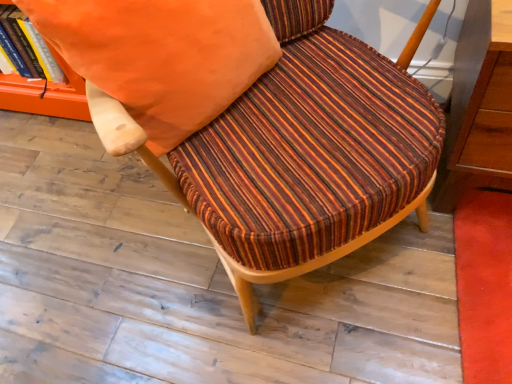
Locate an element on the screen. The image size is (512, 384). orange fabric book at upper left is located at coordinates (27, 47).

Where is `striped fabric chair at center`? This screenshot has width=512, height=384. striped fabric chair at center is located at coordinates (311, 260).

I want to click on orange fabric book at upper left, so click(27, 47).

Considering the points (433, 3) and (154, 58), which point is in front, point (433, 3) or point (154, 58)?

Point (154, 58)

Is striped fabric chair at center looking in the opposite direction of orange fabric pillow at upper center?

Absolutely, striped fabric chair at center is directed away from orange fabric pillow at upper center.

In the scene shown: From a real-world perspective, who is located higher, striped fabric chair at center or orange fabric pillow at upper center?

orange fabric pillow at upper center.

Does striped fabric chair at center touch orange fabric pillow at upper center?

striped fabric chair at center is not next to orange fabric pillow at upper center, and they're not touching.

In the scene shown: From the image's perspective, who appears lower, orange fabric book at upper left or orange fabric pillow at upper center?

orange fabric pillow at upper center appears lower in the image.

Which object is thinner, orange fabric book at upper left or orange fabric pillow at upper center?

orange fabric book at upper left is thinner.

How distant is orange fabric book at upper left from orange fabric pillow at upper center?

orange fabric book at upper left and orange fabric pillow at upper center are 31.41 inches apart from each other.

Is orange fabric book at upper left aimed at orange fabric pillow at upper center?

No.

Is orange fabric book at upper left turned away from striped fabric chair at center?

No.

Who is taller, orange fabric book at upper left or striped fabric chair at center?

With more height is striped fabric chair at center.

Looking at their sizes, would you say orange fabric book at upper left is wider or thinner than striped fabric chair at center?

orange fabric book at upper left is thinner than striped fabric chair at center.

Which is closer, (x=7, y=52) or (x=240, y=267)?

Point (x=7, y=52) is positioned farther from the camera compared to point (x=240, y=267).

Could you tell me if orange fabric pillow at upper center is turned towards striped fabric chair at center?

Yes, orange fabric pillow at upper center is turned towards striped fabric chair at center.

Between orange fabric pillow at upper center and striped fabric chair at center, which one has smaller size?

orange fabric pillow at upper center is smaller.

From the image's perspective, which one is positioned lower, orange fabric pillow at upper center or striped fabric chair at center?

striped fabric chair at center, from the image's perspective.

Considering the points (226, 68) and (353, 242), which point is in front, point (226, 68) or point (353, 242)?

Positioned in front is point (226, 68).

Looking at this image, between orange fabric pillow at upper center and orange fabric book at upper left, which one has larger width?

orange fabric pillow at upper center is wider.

Who is shorter, orange fabric pillow at upper center or orange fabric book at upper left?

orange fabric book at upper left.

Could you tell me if orange fabric pillow at upper center is turned towards orange fabric book at upper left?

No, orange fabric pillow at upper center is not aimed at orange fabric book at upper left.

From the image's perspective, does striped fabric chair at center appear higher than orange fabric book at upper left?

Actually, striped fabric chair at center appears below orange fabric book at upper left in the image.

Is striped fabric chair at center thinner than orange fabric book at upper left?

In fact, striped fabric chair at center might be wider than orange fabric book at upper left.

Can you tell me how much striped fabric chair at center and orange fabric book at upper left differ in facing direction?

The angle between the facing direction of striped fabric chair at center and the facing direction of orange fabric book at upper left is 44.7 degrees.

Identify the location of throw pillow behind the striped fabric chair at center. The height and width of the screenshot is (384, 512). (159, 60).

This screenshot has height=384, width=512. I want to click on throw pillow that appears on the right of orange fabric book at upper left, so click(159, 60).

From the image, which object appears to be farther from striped fabric chair at center, orange fabric pillow at upper center or orange fabric book at upper left?

orange fabric book at upper left lies further to striped fabric chair at center than the other object.

Looking at the image, which one is located closer to orange fabric pillow at upper center, striped fabric chair at center or orange fabric book at upper left?

striped fabric chair at center lies closer to orange fabric pillow at upper center than the other object.

From the image, which object appears to be farther from striped fabric chair at center, orange fabric book at upper left or orange fabric pillow at upper center?

orange fabric book at upper left lies further to striped fabric chair at center than the other object.

Which object lies nearer to the anchor point orange fabric pillow at upper center, orange fabric book at upper left or striped fabric chair at center?

striped fabric chair at center.

Based on their spatial positions, is orange fabric pillow at upper center or striped fabric chair at center closer to orange fabric book at upper left?

Based on the image, orange fabric pillow at upper center appears to be nearer to orange fabric book at upper left.

From the image, which object appears to be farther from orange fabric book at upper left, striped fabric chair at center or orange fabric pillow at upper center?

striped fabric chair at center is positioned further to the anchor orange fabric book at upper left.

I want to click on throw pillow located between striped fabric chair at center and orange fabric book at upper left in the depth direction, so click(x=159, y=60).